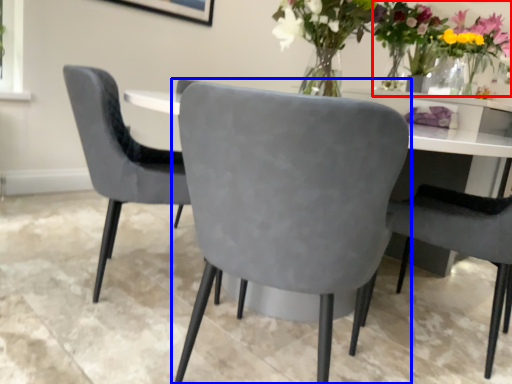
Question: Which of the following is the farthest to the observer, floral arrangement (highlighted by a red box) or chair (highlighted by a blue box)?

Choices:
 (A) floral arrangement
 (B) chair

Answer: (A)